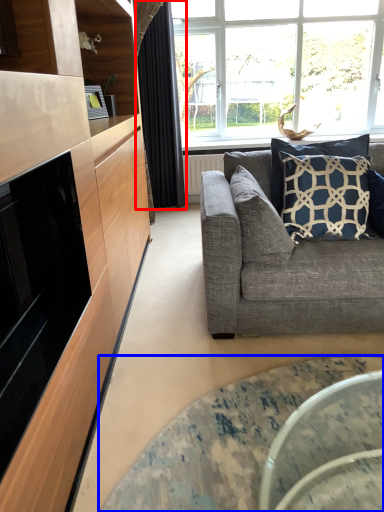
Question: Which object appears closest to the camera in this image, curtain (highlighted by a red box) or coffee table (highlighted by a blue box)?

Choices:
 (A) curtain
 (B) coffee table

Answer: (B)